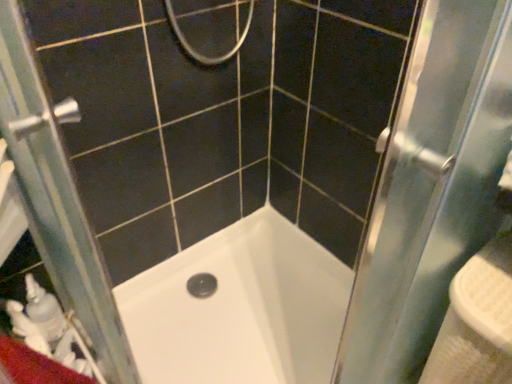
Measure the distance between point (x=55, y=183) and camera.

A distance of 71.80 centimeters exists between point (x=55, y=183) and camera.

The image size is (512, 384). In order to click on white glossy bathtub at center in this screenshot , I will do `click(240, 308)`.

Does point (12, 95) lie in front of point (459, 368)?

Yes, it is.

From the image's perspective, which one is positioned higher, clear glass screen door at left or white plastic sink at right?

clear glass screen door at left, from the image's perspective.

Can you confirm if clear glass screen door at left is thinner than white plastic sink at right?

Yes.

How far apart are clear glass screen door at left and white plastic sink at right?

The distance of clear glass screen door at left from white plastic sink at right is 30.17 inches.

How much distance is there between white plastic sink at right and clear glass screen door at left?

white plastic sink at right and clear glass screen door at left are 30.17 inches apart from each other.

Is white plastic sink at right to the left of clear glass screen door at left from the viewer's perspective?

No.

Between white plastic sink at right and clear glass screen door at left, which one has larger size?

With larger size is clear glass screen door at left.

Is white plastic sink at right behind clear glass screen door at left?

Yes, white plastic sink at right is further from the camera.

From a real-world perspective, is clear glass screen door at left positioned above or below white glossy bathtub at center?

clear glass screen door at left is above white glossy bathtub at center.

Does clear glass screen door at left have a greater height compared to white glossy bathtub at center?

Yes, clear glass screen door at left is taller than white glossy bathtub at center.

Is clear glass screen door at left in front of white glossy bathtub at center?

Yes, it is in front of white glossy bathtub at center.

Which point is more distant from viewer, (298, 264) or (501, 354)?

The point (298, 264) is farther.

Choose the correct answer: Is white glossy bathtub at center inside white plastic sink at right or outside it?

white glossy bathtub at center exists outside the volume of white plastic sink at right.

From a real-world perspective, is white glossy bathtub at center physically located above or below white plastic sink at right?

white glossy bathtub at center is situated lower than white plastic sink at right in the real world.

From a real-world perspective, is white plastic sink at right above or below white glossy bathtub at center?

white plastic sink at right is above white glossy bathtub at center.

Based on the photo, is white plastic sink at right aimed at white glossy bathtub at center?

No, white plastic sink at right is not aimed at white glossy bathtub at center.

In order to click on sink on the right of white glossy bathtub at center in this screenshot , I will do 477,322.

Identify the location of screen door on the left side of white glossy bathtub at center. (57, 202).

Considering the sizes of objects white glossy bathtub at center and clear glass screen door at left in the image provided, who is shorter, white glossy bathtub at center or clear glass screen door at left?

white glossy bathtub at center is shorter.

Between white glossy bathtub at center and clear glass screen door at left, which one is positioned in front?

clear glass screen door at left.

Can we say white glossy bathtub at center lies outside clear glass screen door at left?

Yes, white glossy bathtub at center is not within clear glass screen door at left.

There is a white plastic sink at right. What are the coordinates of `screen door above it (from a real-world perspective)` in the screenshot? It's located at (57, 202).

The height and width of the screenshot is (384, 512). Find the location of `sink that appears below the clear glass screen door at left (from the image's perspective)`. sink that appears below the clear glass screen door at left (from the image's perspective) is located at coordinates (477, 322).

Considering their positions, is white glossy bathtub at center positioned further to white plastic sink at right than clear glass screen door at left?

clear glass screen door at left.

Based on their spatial positions, is clear glass screen door at left or white glossy bathtub at center further from white plastic sink at right?

Based on the image, clear glass screen door at left appears to be further to white plastic sink at right.

Which object lies nearer to the anchor point white glossy bathtub at center, clear glass screen door at left or white plastic sink at right?

Among the two, clear glass screen door at left is located nearer to white glossy bathtub at center.

Based on the photo, which object lies further to the anchor point clear glass screen door at left, white glossy bathtub at center or white plastic sink at right?

white plastic sink at right is positioned further to the anchor clear glass screen door at left.

Considering their positions, is white plastic sink at right positioned further to clear glass screen door at left than white glossy bathtub at center?

white plastic sink at right is further to clear glass screen door at left.

When comparing their distances from white glossy bathtub at center, does white plastic sink at right or clear glass screen door at left seem further?

white plastic sink at right is further to white glossy bathtub at center.

This screenshot has width=512, height=384. What are the coordinates of `bathtub between clear glass screen door at left and white plastic sink at right` in the screenshot? It's located at (240, 308).